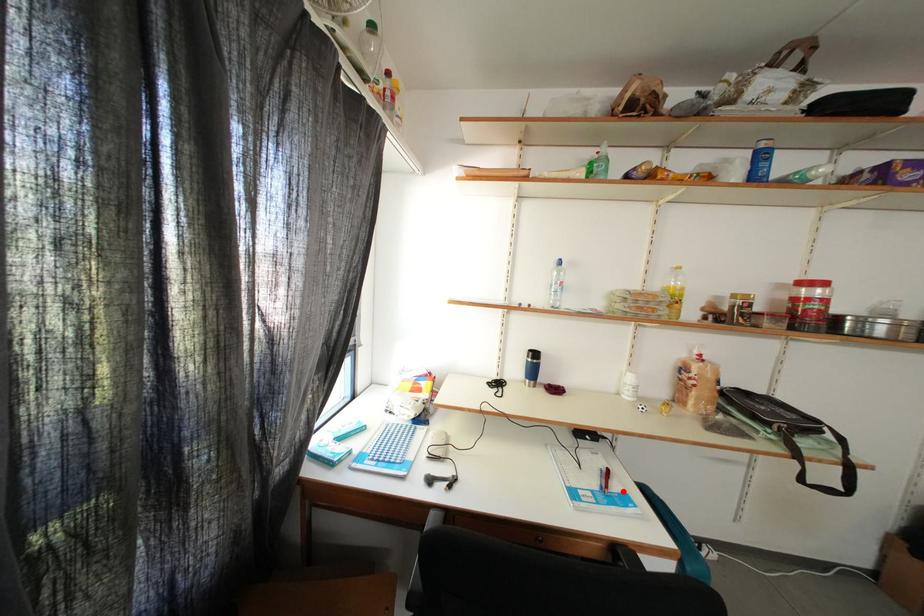
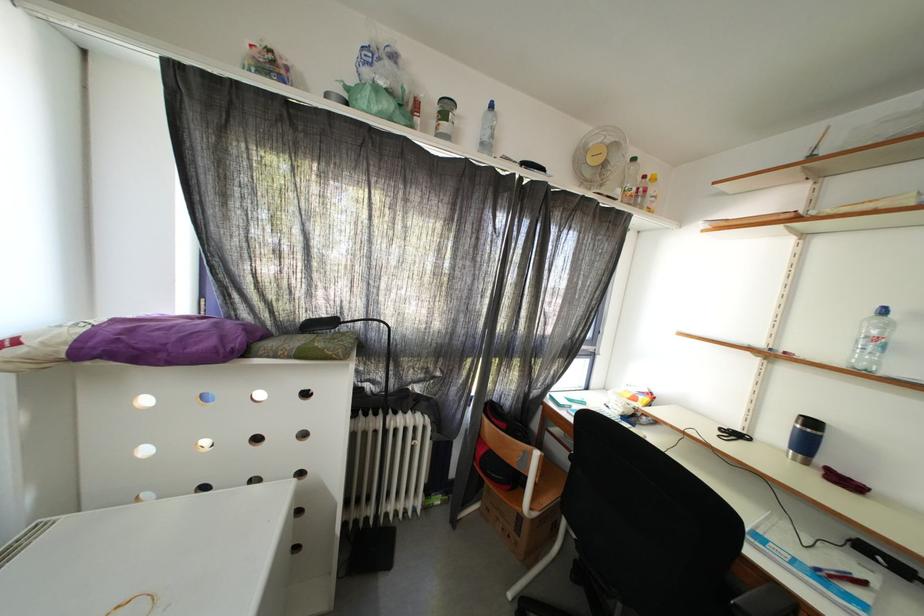
Question: I am providing you with two images of the same scene from different viewpoints. In image1, a red point is highlighted. Considering the same 3D point in image2, which of the following is correct?

Choices:
 (A) It is closer
 (B) It is farther

Answer: (A)